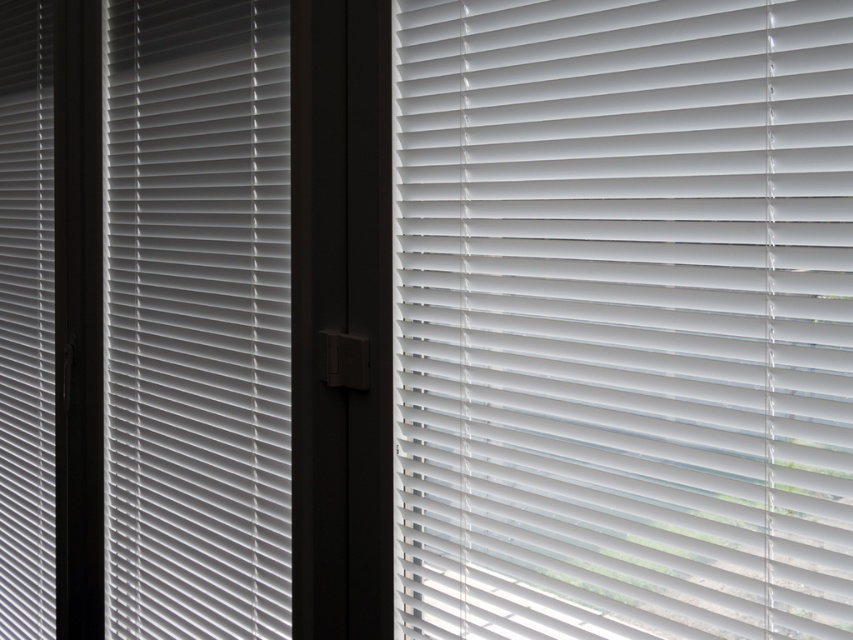
You are designing a room and need to know the width of the white plastic blinds at right and white plastic blinds at left to ensure proper placement. Which set of blinds is narrower?

The white plastic blinds at right are narrower than the white plastic blinds at left.

You are standing in a room and looking through the window. You notice two sections of white plastic blinds at right and white plastic blinds at left. Which section of the blinds is closer to you?

The white plastic blinds at right is closer to you because it is in front of the white plastic blinds at left.

You are standing in a room with a window covered by blinds. You need to locate the white plastic blinds at right. According to the coordinates provided, where exactly are they positioned?

The white plastic blinds at right are located at the coordinates point (x=622, y=317).